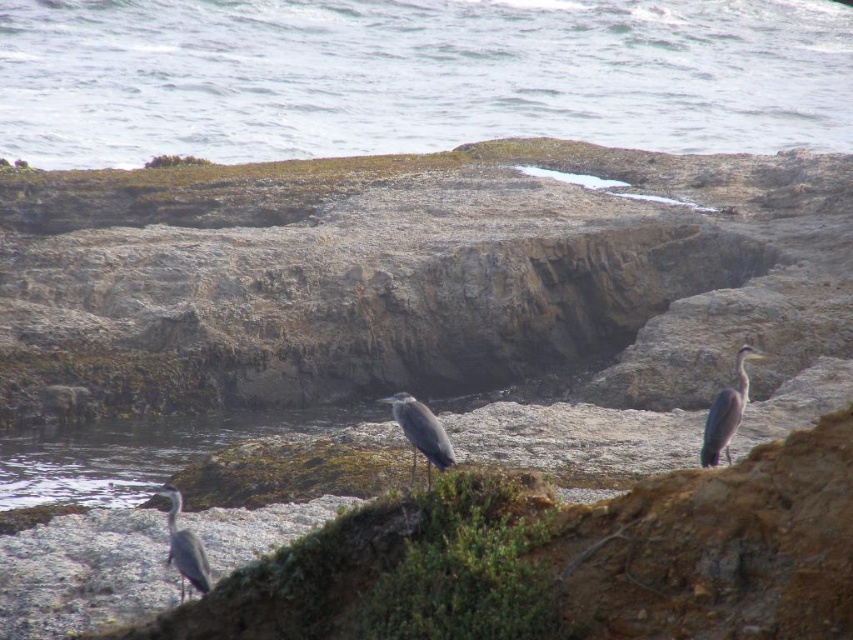
Does clear water at center have a smaller size compared to gray matte heron at lower left?

No.

Who is shorter, clear water at center or gray matte heron at lower left?

gray matte heron at lower left

Does point (357, 81) lie behind point (195, 541)?

Yes.

Locate an element on the screen. clear water at center is located at coordinates (416, 76).

In the scene shown: Between gray matte bird at center and gray matte heron at lower left, which one has less height?

Standing shorter between the two is gray matte bird at center.

Between point (415, 422) and point (183, 548), which one is positioned in front?

Point (183, 548) is more forward.

Locate an element on the screen. This screenshot has width=853, height=640. gray matte bird at center is located at coordinates (421, 433).

Is point (114, 120) behind point (433, 413)?

Yes.

Is clear water at center bigger than gray matte bird at center?

Yes, clear water at center is bigger than gray matte bird at center.

The width and height of the screenshot is (853, 640). Describe the element at coordinates (416, 76) in the screenshot. I see `clear water at center` at that location.

The image size is (853, 640). In order to click on clear water at center in this screenshot , I will do `click(416, 76)`.